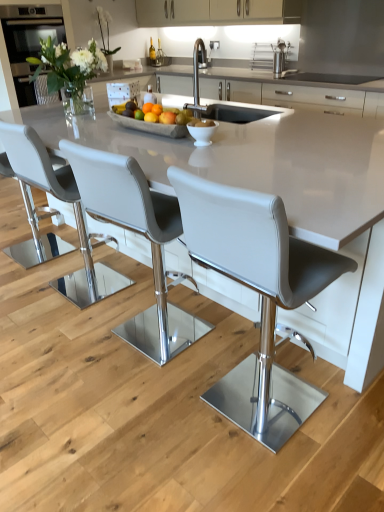
Locate an element on the screen. This screenshot has height=512, width=384. free spot to the right of white ceramic bowl at center is located at coordinates (238, 141).